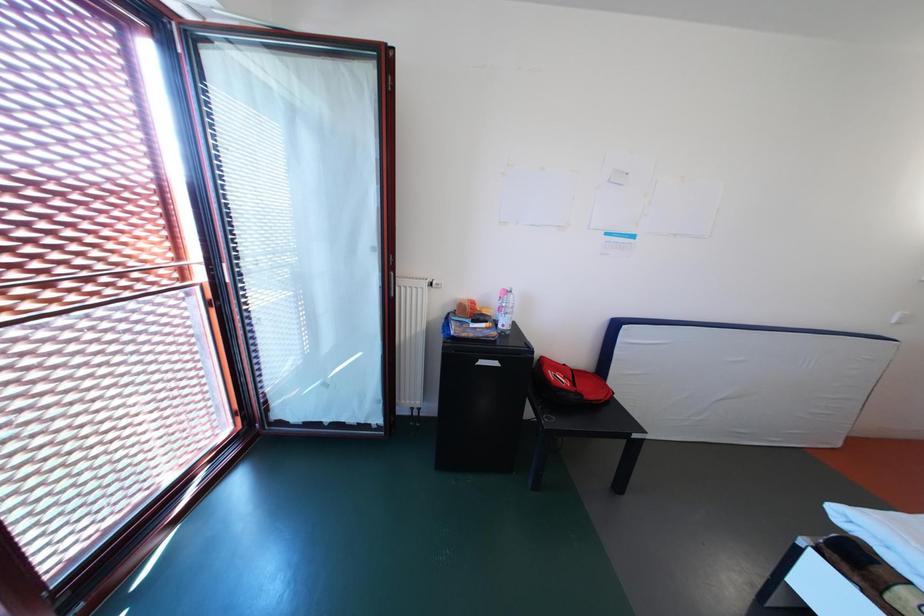
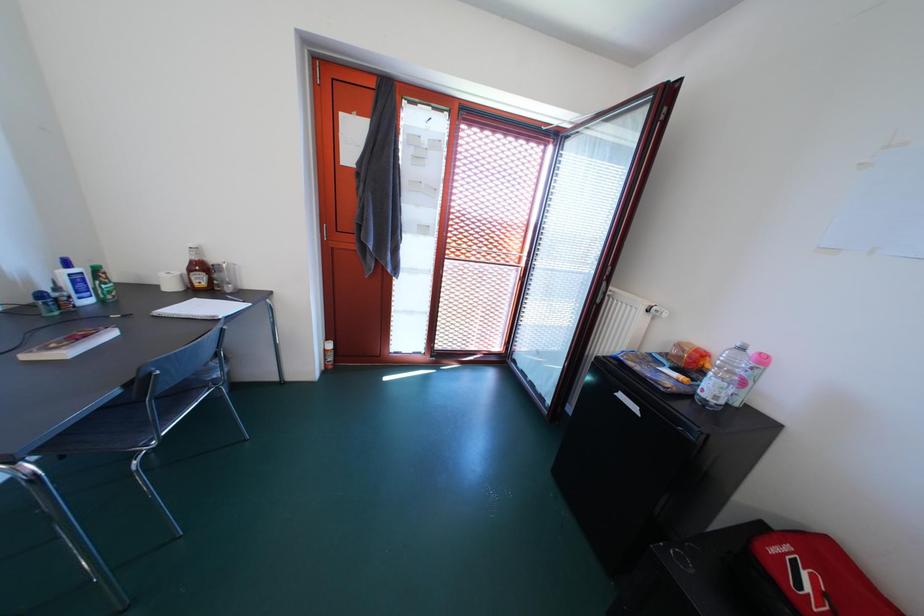
Question: The first image is from the beginning of the video and the second image is from the end. How did the camera likely rotate when shooting the video?

Choices:
 (A) Left
 (B) Right
 (C) Up
 (D) Down

Answer: (A)